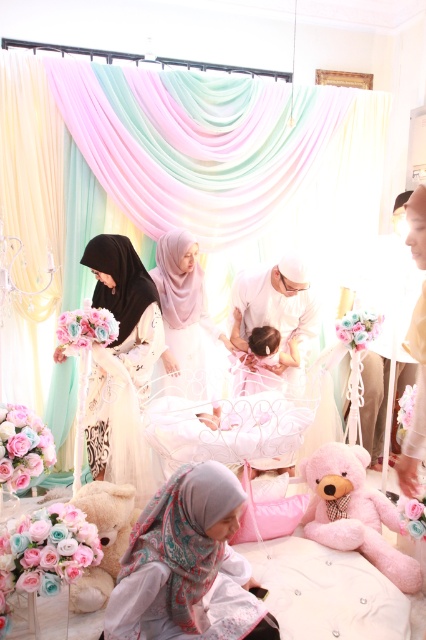
Can you confirm if fluffy pink teddy bear at lower right is smaller than matte white dress at center?

Yes.

Can you confirm if fluffy pink teddy bear at lower right is taller than matte white dress at center?

In fact, fluffy pink teddy bear at lower right may be shorter than matte white dress at center.

Between point (382, 522) and point (158, 273), which one is positioned behind?

The point (158, 273) is more distant.

Where is `fluffy pink teddy bear at lower right`? This screenshot has width=426, height=640. fluffy pink teddy bear at lower right is located at coordinates (354, 513).

Is matte white dress at center further to camera compared to soft beige teddy bear at lower left?

That is True.

Can you confirm if matte white dress at center is thinner than soft beige teddy bear at lower left?

Incorrect, matte white dress at center's width is not less than soft beige teddy bear at lower left's.

Who is more distant from viewer, [169,284] or [83,582]?

The point [169,284] is behind.

Locate an element on the screen. matte white dress at center is located at coordinates [x=184, y=317].

Which is behind, point (138, 348) or point (347, 516)?

The point (138, 348) is more distant.

Does white lace dress at left have a smaller size compared to fluffy pink teddy bear at lower right?

Actually, white lace dress at left might be larger than fluffy pink teddy bear at lower right.

I want to click on white lace dress at left, so click(x=121, y=365).

This screenshot has width=426, height=640. I want to click on white lace dress at left, so click(x=121, y=365).